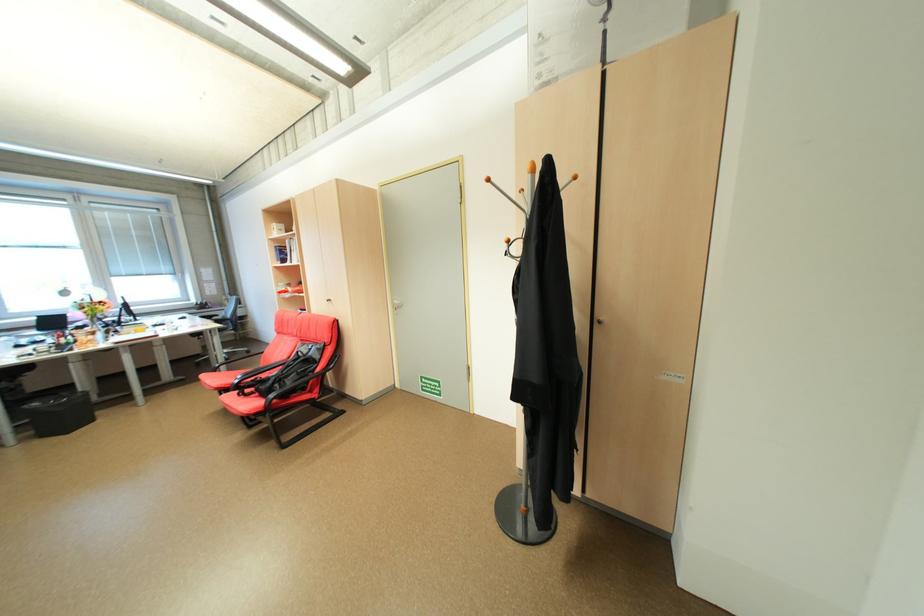
Image resolution: width=924 pixels, height=616 pixels. Describe the element at coordinates (511, 197) in the screenshot. I see `a orange tipped hook` at that location.